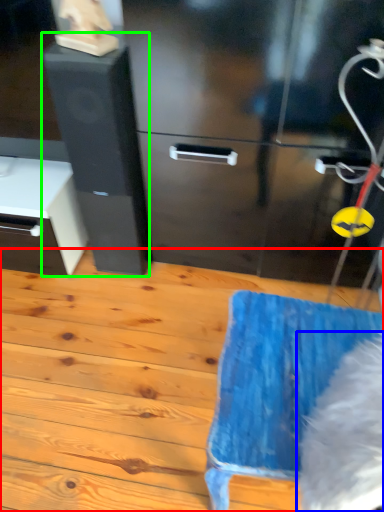
Question: Estimate the real-world distances between objects in this image. Which object is farther from wood (highlighted by a red box), animal (highlighted by a blue box) or file cabinet (highlighted by a green box)?

Choices:
 (A) animal
 (B) file cabinet

Answer: (A)